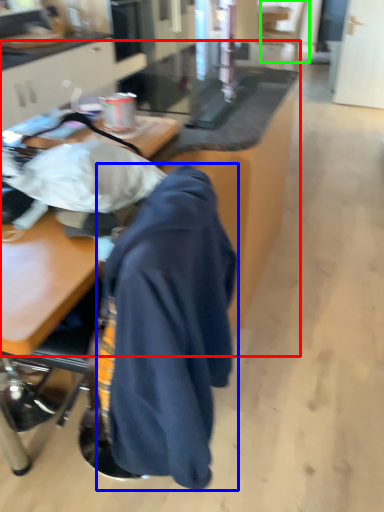
Question: Which object is positioned closest to table (highlighted by a red box)? Select from cloak (highlighted by a blue box) and swivel chair (highlighted by a green box).

Choices:
 (A) cloak
 (B) swivel chair

Answer: (A)